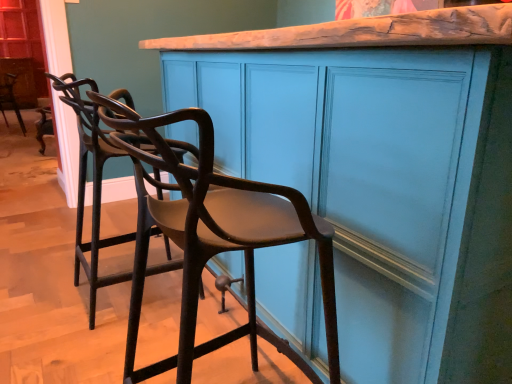
Question: Does point (316, 226) appear closer or farther from the camera than point (95, 82)?

Choices:
 (A) closer
 (B) farther

Answer: (A)

Question: Relative to matte black chair at left, placed as the second chair when sorted from right to left, is brown wood chair at center, positioned as the 3th chair in back-to-front order, in front or behind?

Choices:
 (A) front
 (B) behind

Answer: (A)

Question: Estimate the real-world distances between objects in this image. Which object is farther from the matte teal cabinet at center?

Choices:
 (A) matte black chair at left, which is counted as the second chair, starting from the left
 (B) metallic dark brown chair at left, marked as the 1th chair in a left-to-right arrangement
 (C) brown wood chair at center, arranged as the first chair when viewed from the front

Answer: (B)

Question: Estimate the real-world distances between objects in this image. Which object is farther from the brown wood chair at center, arranged as the first chair when viewed from the front?

Choices:
 (A) matte teal cabinet at center
 (B) matte black chair at left, arranged as the second chair when viewed from the front
 (C) metallic dark brown chair at left, which appears as the third chair when viewed from the front

Answer: (C)